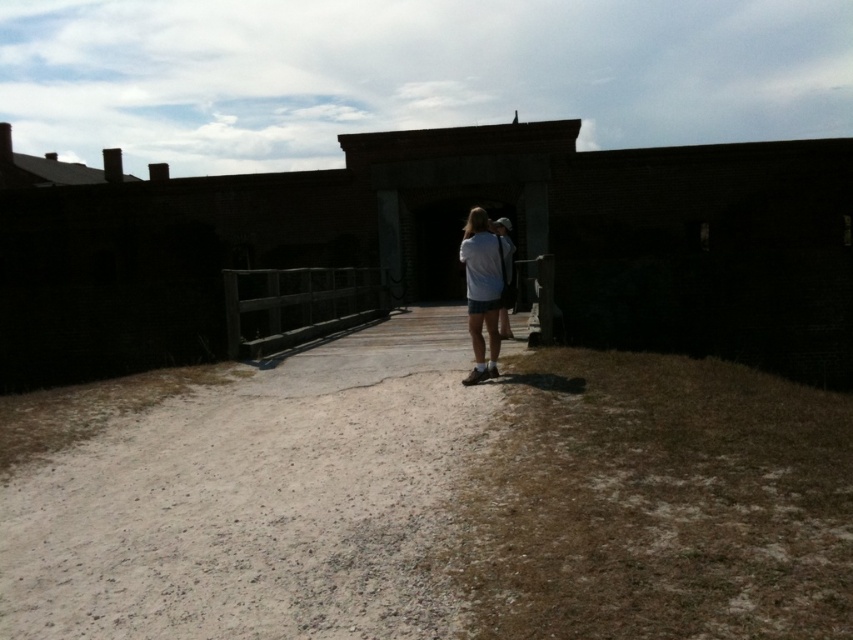
Is point (469, 248) closer to viewer compared to point (506, 321)?

Yes, it is in front of point (506, 321).

Can you confirm if white matte shirt at center is positioned to the left of white cotton shirt at center?

Correct, you'll find white matte shirt at center to the left of white cotton shirt at center.

Identify the location of white matte shirt at center. (482, 291).

Where is `white matte shirt at center`? white matte shirt at center is located at coordinates (482, 291).

Does wooden at center have a larger size compared to white matte shirt at center?

Yes, wooden at center is bigger than white matte shirt at center.

Can you confirm if wooden at center is positioned above white matte shirt at center?

Actually, wooden at center is below white matte shirt at center.

Does point (305, 330) come closer to viewer compared to point (486, 220)?

No, it is not.

Locate an element on the screen. The height and width of the screenshot is (640, 853). wooden at center is located at coordinates (300, 305).

At what (x,y) coordinates should I click in order to perform the action: click on brown gravel path at center. Please return your answer as a coordinate pair (x, y). Looking at the image, I should click on (257, 500).

Who is more distant from viewer, (380, 424) or (317, 333)?

The point (317, 333) is behind.

The height and width of the screenshot is (640, 853). I want to click on brown gravel path at center, so click(x=257, y=500).